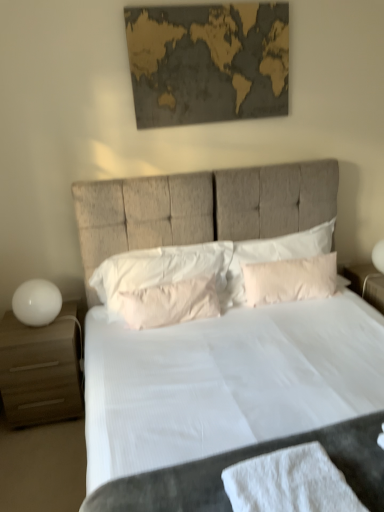
Measure the distance between pink fabric pillow at center, which appears as the second pillow when viewed from the right, and camera.

pink fabric pillow at center, which appears as the second pillow when viewed from the right, and camera are 7.14 feet apart from each other.

What do you see at coordinates (170, 303) in the screenshot? The height and width of the screenshot is (512, 384). I see `pink fabric pillow at center, placed as the second pillow when sorted from left to right` at bounding box center [170, 303].

Locate an element on the screen. The width and height of the screenshot is (384, 512). matte wood nightstand at left is located at coordinates (40, 372).

Measure the distance between point (x=35, y=323) and camera.

Point (x=35, y=323) is 7.33 feet from camera.

Image resolution: width=384 pixels, height=512 pixels. Find the location of `white cotton bath towel at lower center`. white cotton bath towel at lower center is located at coordinates (290, 483).

Identify the location of gold textured map at upper center. The width and height of the screenshot is (384, 512). (208, 62).

Where is `pink fabric pillow at center, which appears as the second pillow when viewed from the right`? Image resolution: width=384 pixels, height=512 pixels. pink fabric pillow at center, which appears as the second pillow when viewed from the right is located at coordinates (170, 303).

Is white cotton bath towel at lower center taller than matte wood nightstand at left?

No, white cotton bath towel at lower center is not taller than matte wood nightstand at left.

From the image's perspective, does white cotton bath towel at lower center appear lower than matte wood nightstand at left?

Yes.

Looking at this image, is white cotton bath towel at lower center placed right next to matte wood nightstand at left?

No, white cotton bath towel at lower center is not with matte wood nightstand at left.

Based on the photo, looking at the image, does gold textured map at upper center seem bigger or smaller compared to white fabric bed at center?

Clearly, gold textured map at upper center is smaller in size than white fabric bed at center.

How many degrees apart are the facing directions of gold textured map at upper center and white fabric bed at center?

0.617 degrees separate the facing orientations of gold textured map at upper center and white fabric bed at center.

Is gold textured map at upper center in contact with white fabric bed at center?

No, gold textured map at upper center is not touching white fabric bed at center.

Which is behind, point (221, 62) or point (275, 230)?

The point (275, 230) is more distant.

Considering the sizes of objects white glossy table lamp at left and white cotton bath towel at lower center in the image provided, who is wider, white glossy table lamp at left or white cotton bath towel at lower center?

white cotton bath towel at lower center is wider.

Is white glossy table lamp at left to the right of white cotton bath towel at lower center from the viewer's perspective?

No.

Who is taller, white glossy table lamp at left or white cotton bath towel at lower center?

With more height is white glossy table lamp at left.

Which is behind, point (29, 287) or point (248, 509)?

The point (29, 287) is more distant.

Is the position of white fabric bed at center less distant than that of white cotton bath towel at lower center?

Yes, it is in front of white cotton bath towel at lower center.

Is white fabric bed at center oriented towards white cotton bath towel at lower center?

Yes, white fabric bed at center faces towards white cotton bath towel at lower center.

Is white fabric bed at center wider than white cotton bath towel at lower center?

Correct, the width of white fabric bed at center exceeds that of white cotton bath towel at lower center.

Is gold textured map at upper center positioned before pink fabric pillow at center, placed as the second pillow when sorted from left to right?

No, gold textured map at upper center is behind pink fabric pillow at center, placed as the second pillow when sorted from left to right.

Which of these two, gold textured map at upper center or pink fabric pillow at center, which appears as the second pillow when viewed from the right, is smaller?

gold textured map at upper center is smaller.

Considering the positions of points (264, 33) and (146, 326), is point (264, 33) farther from camera compared to point (146, 326)?

Yes, it is.

From a real-world perspective, is gold textured map at upper center on top of pink fabric pillow at center, which appears as the second pillow when viewed from the right?

Correct, in the physical world, gold textured map at upper center is higher than pink fabric pillow at center, which appears as the second pillow when viewed from the right.

From a real-world perspective, who is located lower, gold textured map at upper center or matte wood nightstand at left?

matte wood nightstand at left is physically lower.

Can you confirm if gold textured map at upper center is smaller than matte wood nightstand at left?

Yes, gold textured map at upper center is smaller than matte wood nightstand at left.

Which object is positioned more to the left, gold textured map at upper center or matte wood nightstand at left?

From the viewer's perspective, matte wood nightstand at left appears more on the left side.

Which is farther, (x=169, y=91) or (x=70, y=345)?

Positioned behind is point (x=169, y=91).

Can you confirm if white glossy table lamp at left is shorter than matte wood nightstand at left?

Yes.

Considering the positions of objects white glossy table lamp at left and matte wood nightstand at left in the image provided, who is behind, white glossy table lamp at left or matte wood nightstand at left?

white glossy table lamp at left is more distant.

Is white glossy table lamp at left at the right side of matte wood nightstand at left?

Yes, white glossy table lamp at left is to the right of matte wood nightstand at left.

Find the location of a particular element. The image size is (384, 512). bath towel located on the right of matte wood nightstand at left is located at coordinates tap(290, 483).

Image resolution: width=384 pixels, height=512 pixels. Find the location of `picture frame behind the white fabric bed at center`. picture frame behind the white fabric bed at center is located at coordinates (208, 62).

From the image, which object appears to be farther from pink fabric pillow at center, acting as the third pillow starting from the left, white fabric bed at center or white soft pillow at center, which appears as the 3th pillow when viewed from the right?

white soft pillow at center, which appears as the 3th pillow when viewed from the right.

Considering their positions, is white fabric bed at center positioned closer to pink fabric pillow at center, acting as the third pillow starting from the left, than matte wood nightstand at left?

white fabric bed at center is closer to pink fabric pillow at center, acting as the third pillow starting from the left.

Estimate the real-world distances between objects in this image. Which object is further from white glossy table lamp at left, white cotton bath towel at lower center or pink fabric pillow at center, which appears as the second pillow when viewed from the right?

The object further to white glossy table lamp at left is white cotton bath towel at lower center.

Based on their spatial positions, is white soft pillow at center, which appears as the 3th pillow when viewed from the right, or pink fabric pillow at center, which appears as the second pillow when viewed from the right, closer to white glossy table lamp at left?

white soft pillow at center, which appears as the 3th pillow when viewed from the right, is closer to white glossy table lamp at left.

Based on the photo, looking at the image, which one is located closer to white cotton bath towel at lower center, matte wood nightstand at left or pink fabric pillow at center, which appears as the second pillow when viewed from the right?

pink fabric pillow at center, which appears as the second pillow when viewed from the right, is closer to white cotton bath towel at lower center.

Looking at the image, which one is located closer to gold textured map at upper center, matte wood nightstand at left or pink fabric pillow at center, acting as the third pillow starting from the left?

Based on the image, pink fabric pillow at center, acting as the third pillow starting from the left, appears to be nearer to gold textured map at upper center.

When comparing their distances from pink fabric pillow at center, arranged as the first pillow when viewed from the right, does white cotton bath towel at lower center or white soft pillow at center, which appears as the 3th pillow when viewed from the right, seem further?

The object further to pink fabric pillow at center, arranged as the first pillow when viewed from the right, is white cotton bath towel at lower center.

From the image, which object appears to be farther from gold textured map at upper center, white glossy table lamp at left or white fabric bed at center?

The object further to gold textured map at upper center is white glossy table lamp at left.

The width and height of the screenshot is (384, 512). What are the coordinates of `table lamp between matte wood nightstand at left and white soft pillow at center, positioned as the first pillow in left-to-right order` in the screenshot? It's located at (37, 302).

In order to click on pillow located between matte wood nightstand at left and pink fabric pillow at center, placed as the second pillow when sorted from left to right, in the left-right direction in this screenshot , I will do `click(164, 283)`.

In order to click on pillow between white glossy table lamp at left and pink fabric pillow at center, which appears as the second pillow when viewed from the right, in the horizontal direction in this screenshot , I will do `click(164, 283)`.

Locate an element on the screen. nightstand between white cotton bath towel at lower center and white soft pillow at center, which appears as the 3th pillow when viewed from the right, from front to back is located at coordinates (40, 372).